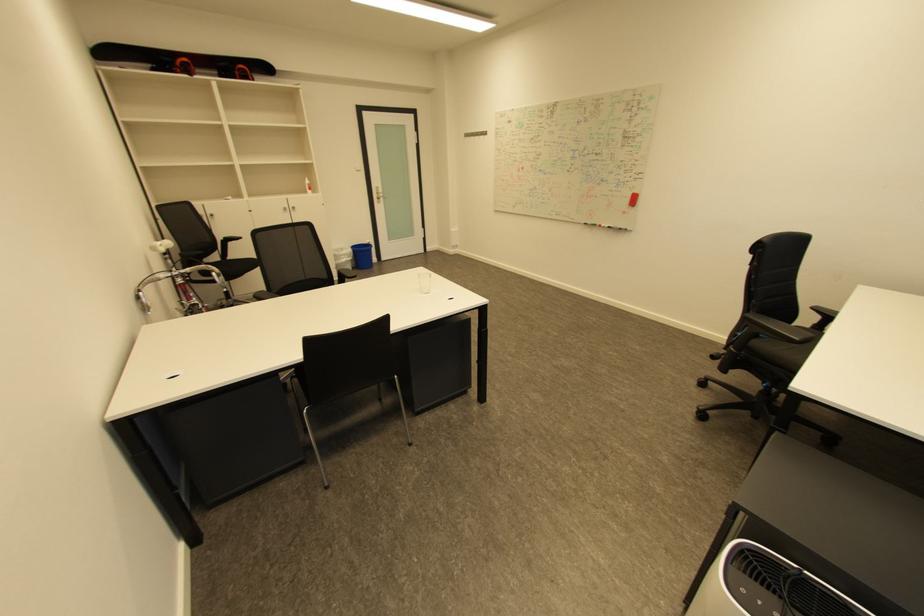
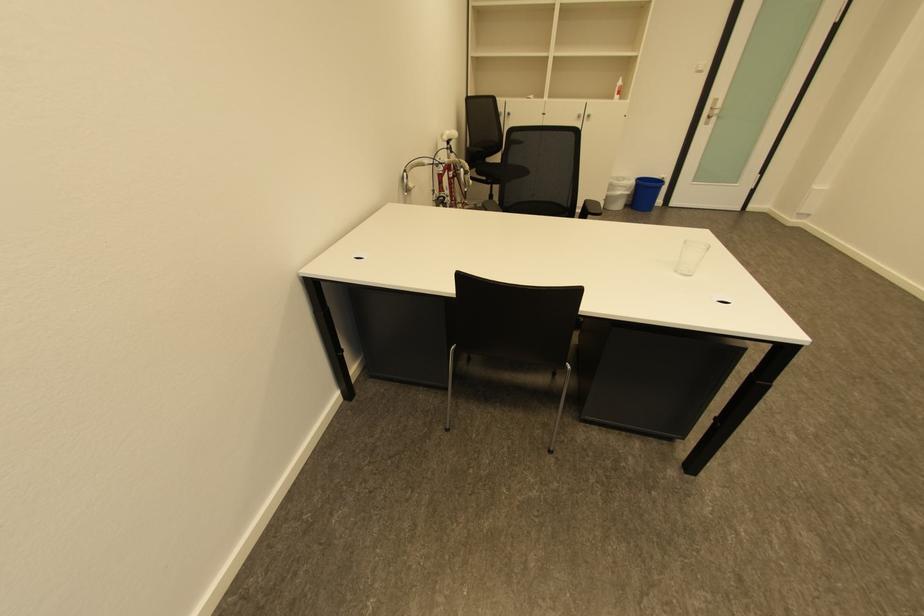
In the second image, find the point that corresponds to [359,261] in the first image.

(635, 196)